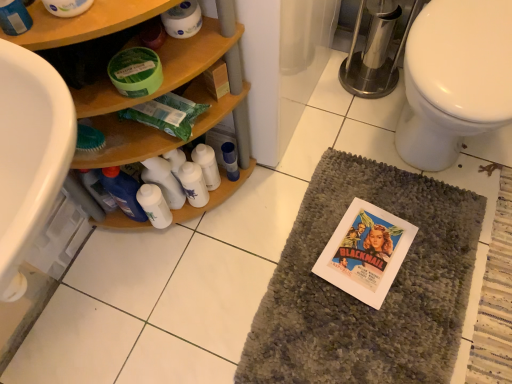
This screenshot has height=384, width=512. I want to click on free spot behind white paper comic book at center, so click(x=355, y=188).